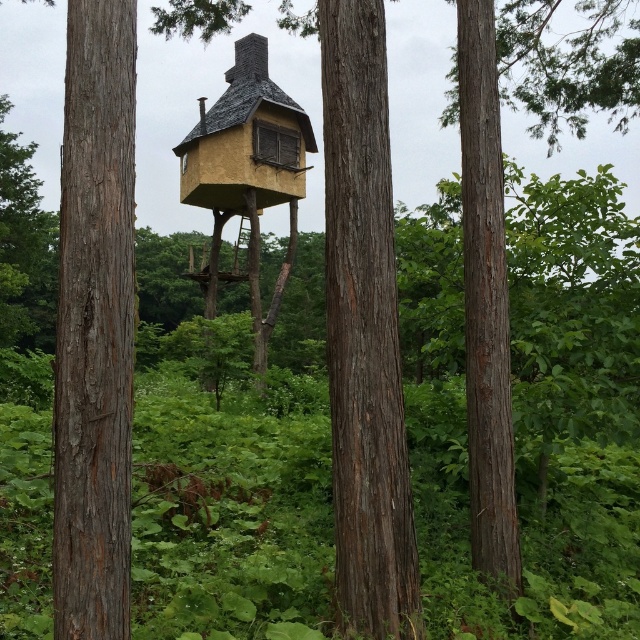
Does point (380, 612) come farther from viewer compared to point (262, 320)?

No, it is in front of (262, 320).

Which of these two, smooth brown tree trunk at center or yellow matte treehouse at center, stands shorter?

With less height is smooth brown tree trunk at center.

Is point (339, 132) less distant than point (253, 148)?

Yes, it is in front of point (253, 148).

Where is `smooth brown tree trunk at center`? This screenshot has width=640, height=640. smooth brown tree trunk at center is located at coordinates (364, 332).

Is smooth brown tree trunk at left taller than smooth brown tree trunk at center?

No.

Is smooth brown tree trunk at left to the right of smooth brown tree trunk at center from the viewer's perspective?

In fact, smooth brown tree trunk at left is to the left of smooth brown tree trunk at center.

The width and height of the screenshot is (640, 640). In order to click on smooth brown tree trunk at left in this screenshot , I will do `click(93, 324)`.

Does smooth brown tree trunk at center appear over brown rough bark tree at center?

Actually, smooth brown tree trunk at center is below brown rough bark tree at center.

Is point (353, 396) less distant than point (484, 390)?

Yes.

Does point (371, 104) lie behind point (481, 192)?

No, it is not.

You are a GUI agent. You are given a task and a screenshot of the screen. Output one action in this format:
    pyautogui.click(x=<x>, y=<y>)
    Task: Click on the smooth brown tree trunk at center
    
    Given the screenshot: What is the action you would take?
    pyautogui.click(x=364, y=332)